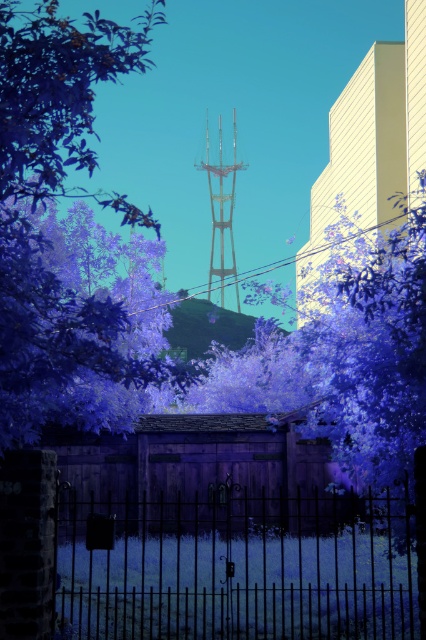
Is purple leafy tree at center positioned behind purple matte tree at center?

No, purple leafy tree at center is closer to the viewer.

Does point (36, 145) come in front of point (296, 396)?

That is True.

Is point (69, 108) less distant than point (371, 340)?

Yes.

The width and height of the screenshot is (426, 640). Identify the location of purple leafy tree at center. (54, 198).

Which is above, metallic silver tower at center or metallic wire at upper center?

metallic silver tower at center is higher up.

Between metallic silver tower at center and metallic wire at upper center, which one appears on the left side from the viewer's perspective?

From the viewer's perspective, metallic silver tower at center appears more on the left side.

Describe the element at coordinates (221, 212) in the screenshot. This screenshot has width=426, height=640. I see `metallic silver tower at center` at that location.

What are the coordinates of `metallic silver tower at center` in the screenshot? It's located at (221, 212).

Does point (339, 618) come behind point (227, 195)?

No, (339, 618) is in front of (227, 195).

Who is more forward, (x=118, y=524) or (x=218, y=260)?

Positioned in front is point (x=118, y=524).

Describe the element at coordinates (238, 566) in the screenshot. This screenshot has width=426, height=640. I see `black wrought iron gate at center` at that location.

You are a GUI agent. You are given a task and a screenshot of the screen. Output one action in this format:
    pyautogui.click(x=<x>, y=<y>)
    Task: Click on the black wrought iron gate at center
    The image size is (426, 640).
    Given the screenshot: What is the action you would take?
    pyautogui.click(x=238, y=566)